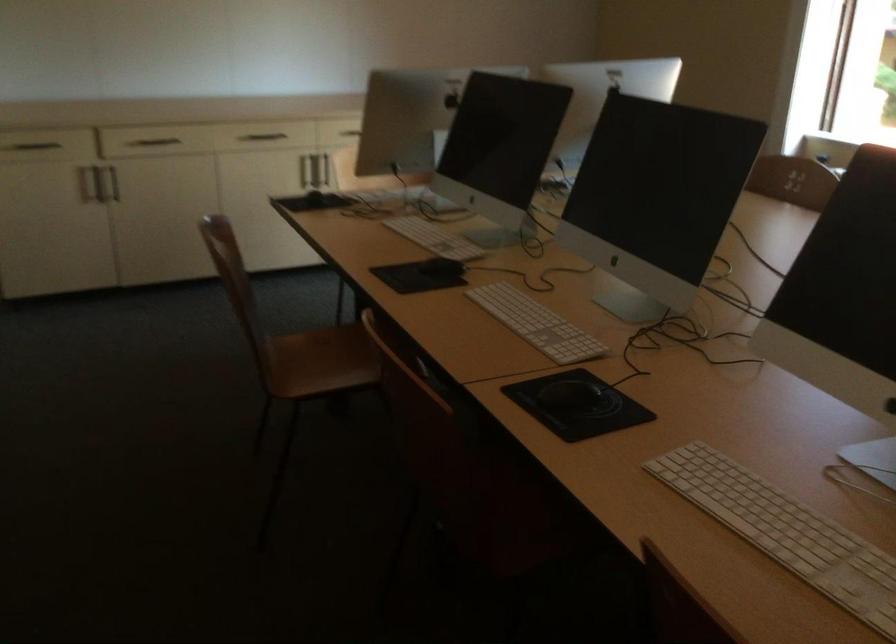
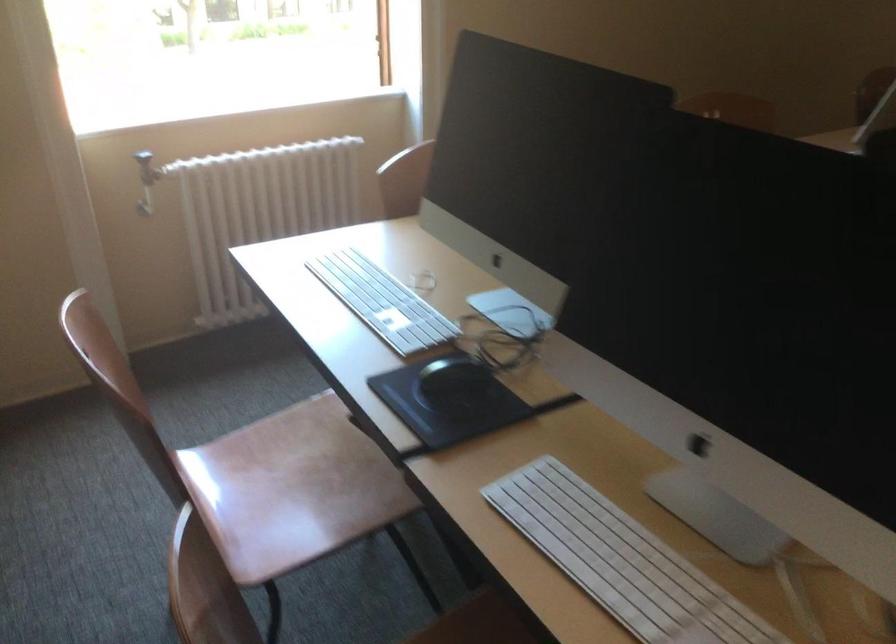
Find the pixel in the second image that matches (x=416, y=196) in the first image.

(622, 561)